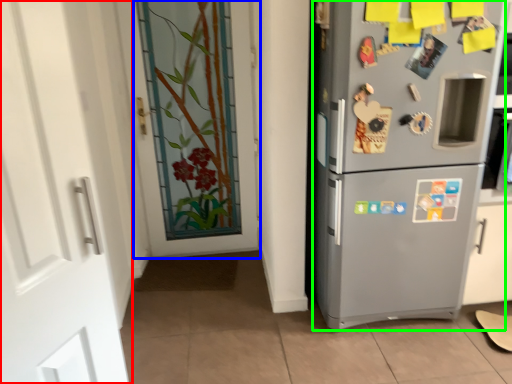
Question: Based on their relative distances, which object is nearer to door (highlighted by a red box)? Choose from door (highlighted by a blue box) and refrigerator (highlighted by a green box).

Choices:
 (A) door
 (B) refrigerator

Answer: (B)